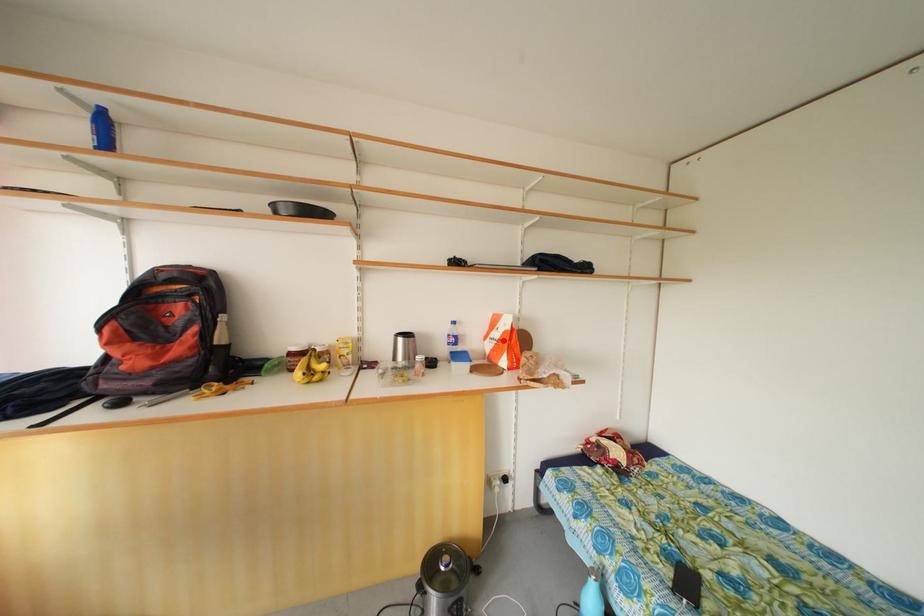
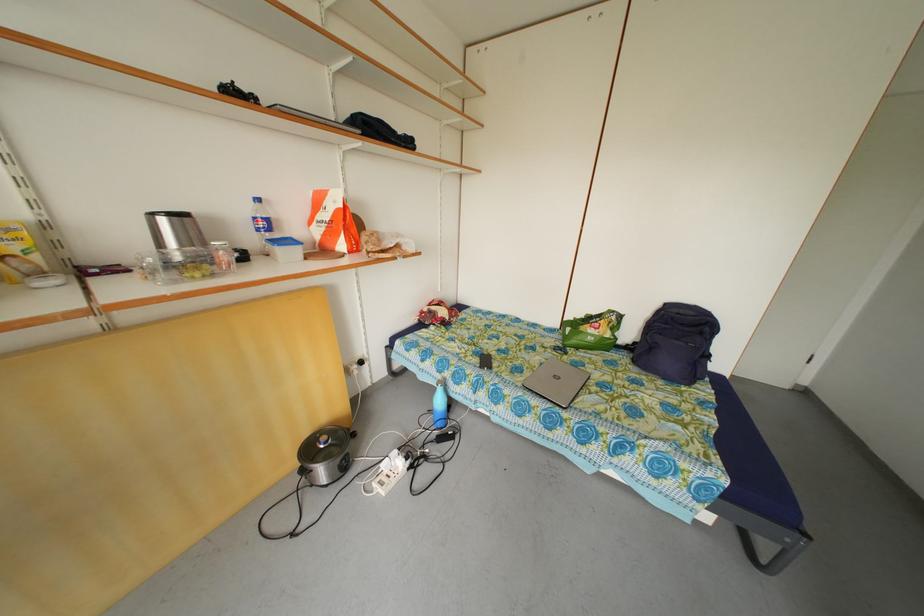
Locate, in the second image, the point that corresponds to the highlighted location in the first image.

(332, 222)